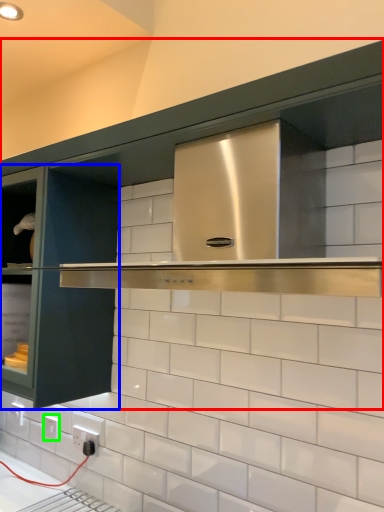
Question: Estimate the real-world distances between objects in this image. Which object is farther from cabinetry (highlighted by a red box), glass door (highlighted by a blue box) or electric outlet (highlighted by a green box)?

Choices:
 (A) glass door
 (B) electric outlet

Answer: (B)